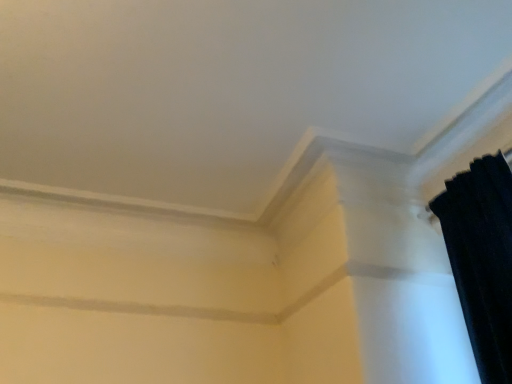
The height and width of the screenshot is (384, 512). Describe the element at coordinates (482, 259) in the screenshot. I see `black fabric curtain at upper right` at that location.

Locate an element on the screen. The image size is (512, 384). black fabric curtain at upper right is located at coordinates (482, 259).

You are a GUI agent. You are given a task and a screenshot of the screen. Output one action in this format:
    pyautogui.click(x=<x>, y=<y>)
    Task: Click on the black fabric curtain at upper right
    The image size is (512, 384).
    Given the screenshot: What is the action you would take?
    pyautogui.click(x=482, y=259)